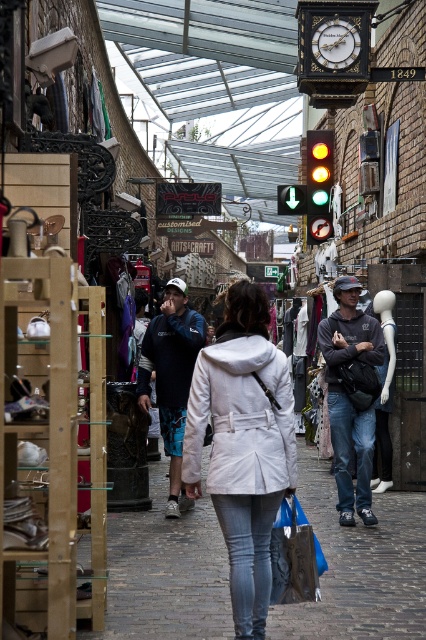
Question: Which point is farther from the camera taking this photo?

Choices:
 (A) (311, 134)
 (B) (245, 308)

Answer: (A)

Question: Does blue fabric bag at center have a greater width compared to green glass traffic light at center?

Choices:
 (A) yes
 (B) no

Answer: (A)

Question: Is white matte coat at center in front of gold polished clock at upper center?

Choices:
 (A) no
 (B) yes

Answer: (B)

Question: Which object appears closest to the camera in this image?

Choices:
 (A) blue/white textured pants at center
 (B) blue fabric bag at center
 (C) white matte coat at center

Answer: (C)

Question: Where is denim jeans at center located in relation to matte gray hoodie at center in the image?

Choices:
 (A) right
 (B) left

Answer: (B)

Question: Which object is positioned closest to the matte gray hoodie at center?

Choices:
 (A) denim jeans at center
 (B) blue/white textured pants at center
 (C) yellow glass traffic light at center

Answer: (A)